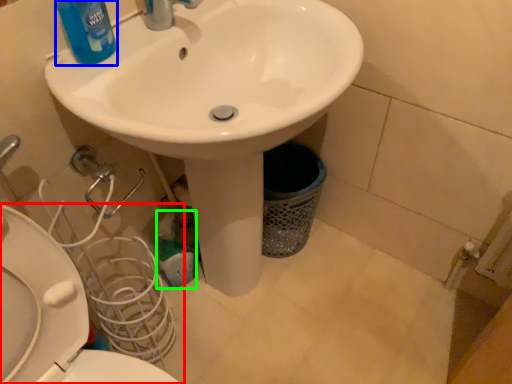
Question: Estimate the real-world distances between objects in this image. Which object is farther from toilet (highlighted by a red box), cleaning product (highlighted by a blue box) or cleaning product (highlighted by a green box)?

Choices:
 (A) cleaning product
 (B) cleaning product

Answer: (B)